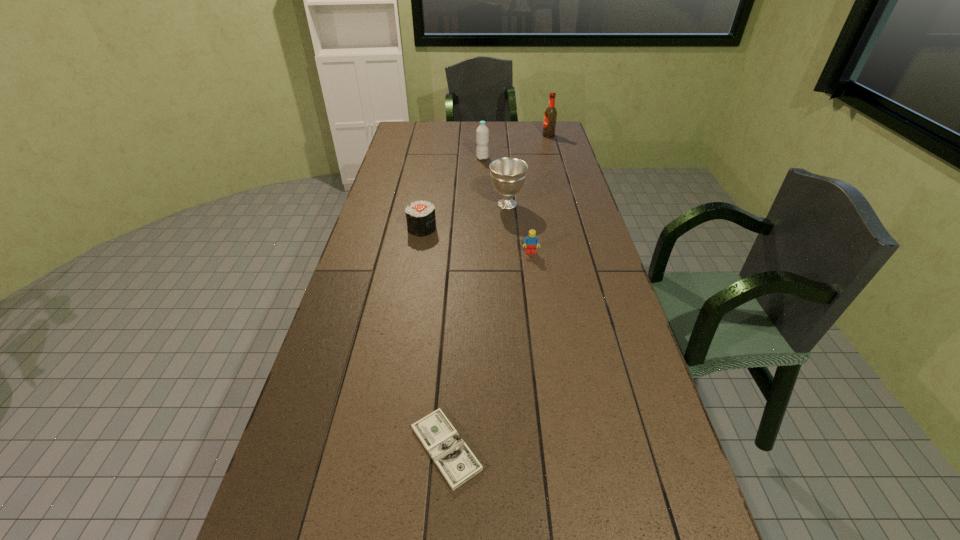
Identify the location of free space between the second farthest object and the third nearest object. (452, 193).

Identify which object is the third nearest to the beer bottle. Please provide its 2D coordinates. Your answer should be formatted as a tuple, i.e. [(x, y)], where the tuple contains the x and y coordinates of a point satisfying the conditions above.

[(421, 220)]

Locate an element on the screen. This screenshot has height=540, width=960. object that is the third closest to the tallest object is located at coordinates (421, 220).

You are a GUI agent. You are given a task and a screenshot of the screen. Output one action in this format:
    pyautogui.click(x=<x>, y=<y>)
    Task: Click on the vacant space that satisfies the following two spatial constraints: 1. on the front side of the shortest object; 2. on the left side of the sushi
    
    Given the screenshot: What is the action you would take?
    pyautogui.click(x=384, y=448)

Find the location of a particular element. free spot that satisfies the following two spatial constraints: 1. on the back side of the fifth nearest object; 2. on the left side of the farthest object is located at coordinates (482, 136).

You are a GUI agent. You are given a task and a screenshot of the screen. Output one action in this format:
    pyautogui.click(x=<x>, y=<y>)
    Task: Click on the free space in the image that satisfies the following two spatial constraints: 1. on the back side of the rightmost object; 2. on the left side of the chalice
    
    Given the screenshot: What is the action you would take?
    [x=501, y=136]

Where is `free location that satisfies the following two spatial constraints: 1. on the front side of the third nearest object; 2. on the right side of the nearest object`? The width and height of the screenshot is (960, 540). free location that satisfies the following two spatial constraints: 1. on the front side of the third nearest object; 2. on the right side of the nearest object is located at coordinates (384, 448).